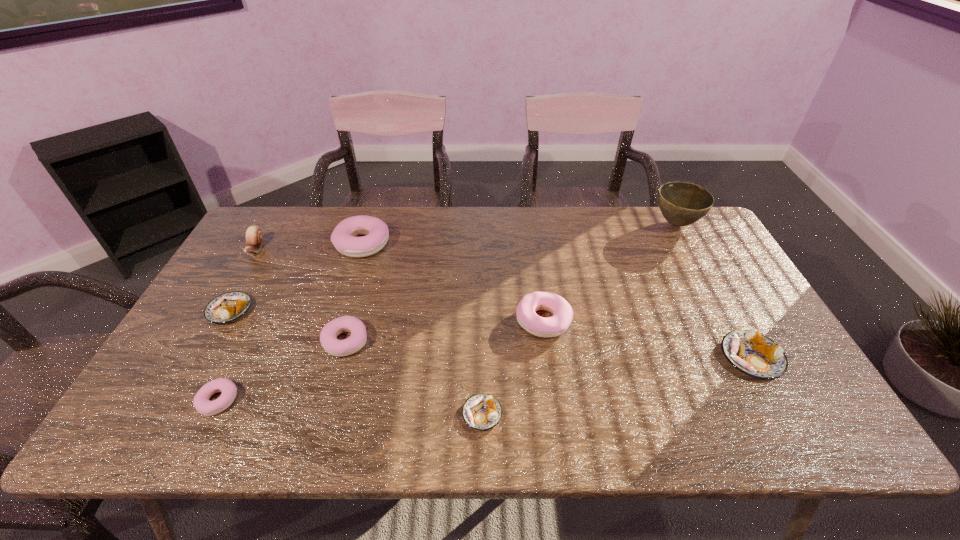
At what (x,y) coordinates should I click in order to perform the action: click on vacant area that satisfies the following two spatial constraints: 1. on the front side of the second nearest brown pastry; 2. on the left side of the third biggest pink pastry. Please return your answer as a coordinate pair (x, y). This screenshot has width=960, height=540. Looking at the image, I should click on (341, 357).

Where is `free space that satisfies the following two spatial constraints: 1. on the back side of the bowl; 2. on the right side of the farthest pink pastry`? Image resolution: width=960 pixels, height=540 pixels. free space that satisfies the following two spatial constraints: 1. on the back side of the bowl; 2. on the right side of the farthest pink pastry is located at coordinates (369, 224).

This screenshot has width=960, height=540. I want to click on free location that satisfies the following two spatial constraints: 1. on the front-facing side of the escargot; 2. on the left side of the leftmost pink pastry, so click(167, 400).